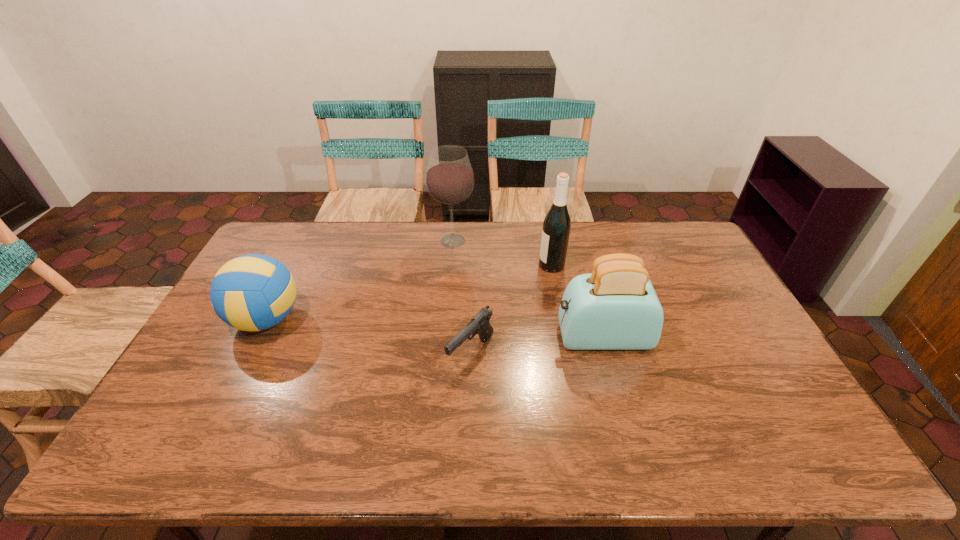
This screenshot has height=540, width=960. Find the location of `vacant position located 0.190m on the side of the third tallest object with the lever`. vacant position located 0.190m on the side of the third tallest object with the lever is located at coordinates (491, 337).

Image resolution: width=960 pixels, height=540 pixels. What are the coordinates of `vacant space located 0.220m on the side of the third tallest object with the lever` in the screenshot? It's located at (481, 337).

Find the location of `free space located 0.080m on the side of the third tallest object with the lever`. free space located 0.080m on the side of the third tallest object with the lever is located at coordinates (528, 337).

Where is `vacant space located on the back of the leftmost object`? vacant space located on the back of the leftmost object is located at coordinates (314, 225).

Locate an element on the screen. Image resolution: width=960 pixels, height=540 pixels. free space located at the muzzle of the gun is located at coordinates (469, 430).

In order to click on alcohol present at the far edge in this screenshot , I will do `click(449, 179)`.

Locate an element on the screen. Image resolution: width=960 pixels, height=540 pixels. wine bottle situated at the far edge is located at coordinates (556, 226).

The height and width of the screenshot is (540, 960). Find the location of `object located in the left edge section of the desktop`. object located in the left edge section of the desktop is located at coordinates (254, 292).

In order to click on vacant space at the far edge of the desktop in this screenshot , I will do `click(527, 240)`.

The height and width of the screenshot is (540, 960). In the image, there is a desktop. Find the location of `blank space at the near edge`. blank space at the near edge is located at coordinates (565, 459).